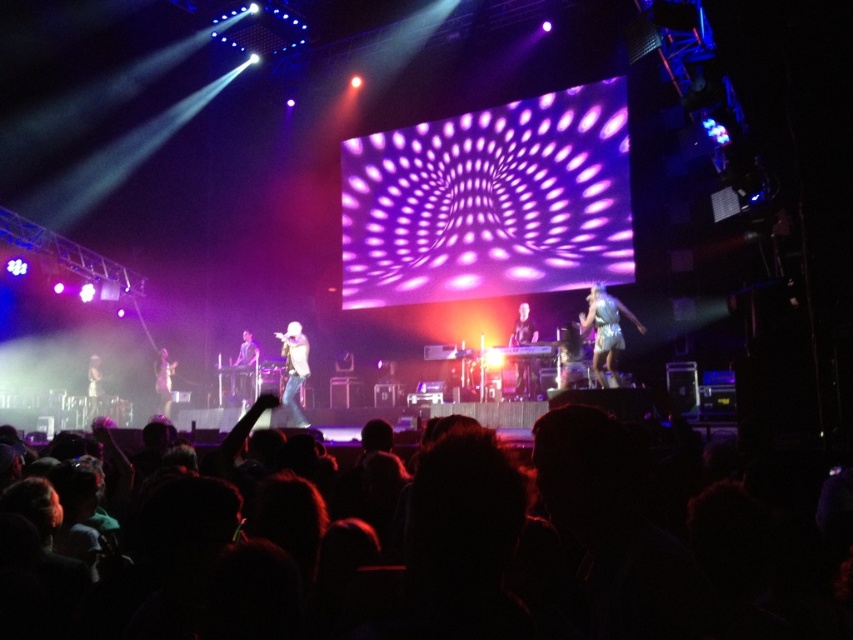
Question: Observing the image, what is the correct spatial positioning of black hair at lower center in reference to matte white microphone at lower left?

Choices:
 (A) below
 (B) above

Answer: (B)

Question: Which object is positioned farthest from the white matte shirt at center?

Choices:
 (A) white sparkly dress at right
 (B) matte white keyboard at center

Answer: (A)

Question: Among these points, which one is farthest from the camera?

Choices:
 (A) (517, 342)
 (B) (244, 362)
 (C) (91, 369)
 (D) (16, 598)

Answer: (C)

Question: Which object appears closest to the camera in this image?

Choices:
 (A) black hair at lower center
 (B) light brown leather jacket at lower left

Answer: (A)

Question: Does white matte shirt at center have a smaller size compared to shiny silver keyboard at center?

Choices:
 (A) no
 (B) yes

Answer: (A)

Question: Does black hair at lower center have a smaller size compared to shiny silver keyboard at center?

Choices:
 (A) yes
 (B) no

Answer: (B)